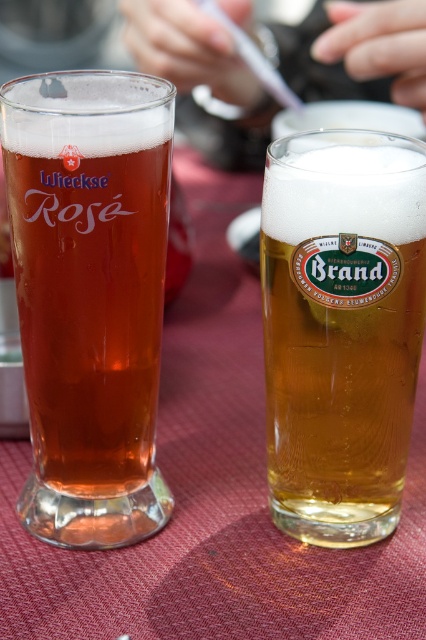
You are a bartender who needs to place a coaster at the exact center between the two glasses. The matte glass at left is at position 0.463 on the x and 0.211 on the y. Where should you place the coaster?

The coaster should be placed at the midpoint between the two glasses. Since the matte glass at left is at coordinates (89, 296), and the other glass is at an unknown position, the exact coordinates cannot be determined without additional information about the second glass.

You have two glasses in front of you on a table. One is the matte glass at left and the other is the golden glass beer at center. You need to pour a drink into the wider glass. Which glass should you choose?

The matte glass at left has a larger width than the golden glass beer at center, so you should choose the matte glass at left to pour the drink into.

Based on the photo, you are a bartender who needs to place a coaster between the matte glass at left and the golden glass beer at center. The coaster has a diameter of 3 inches. Can you fit it between them without moving the glasses?

The distance between the matte glass at left and the golden glass beer at center is 3.41 inches. Since the coaster has a diameter of 3 inches, which is less than the space available, you can fit the coaster between them without moving the glasses.